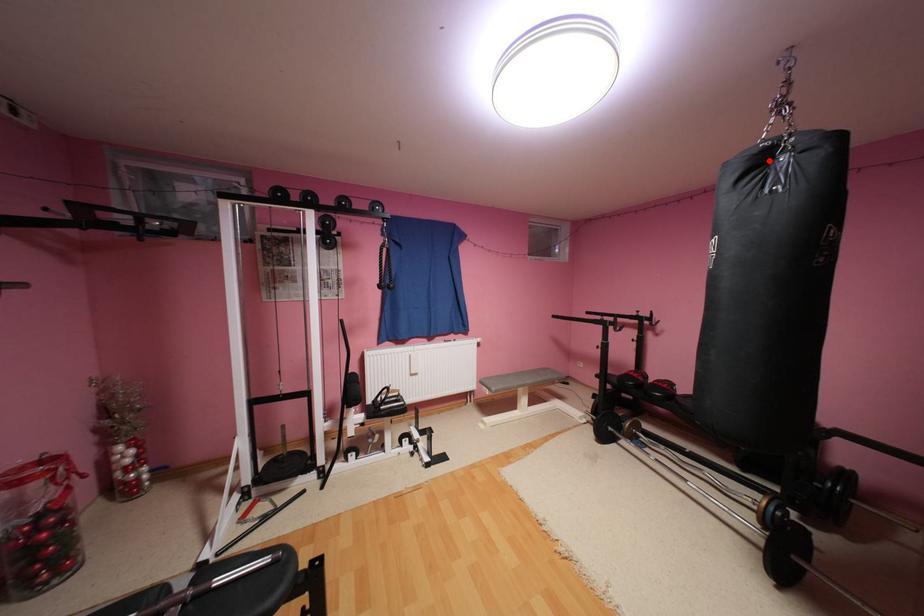
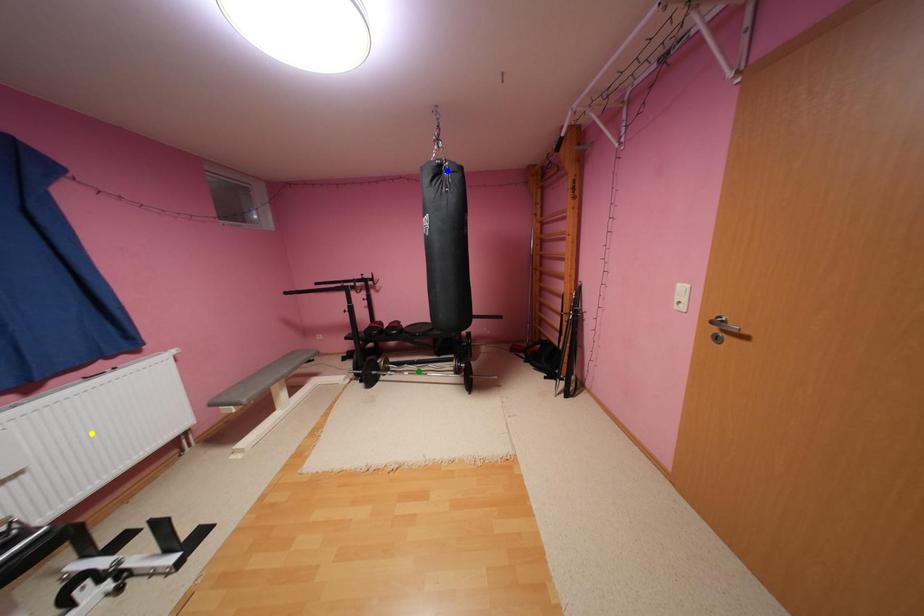
Question: I am providing you with two images of the same scene from different viewpoints. A red point is marked on the first image. You are given multiple points on the second image. Which point in image 2 represents the same 3d spot as the red point in image 1?

Choices:
 (A) yellow point
 (B) green point
 (C) blue point

Answer: (C)